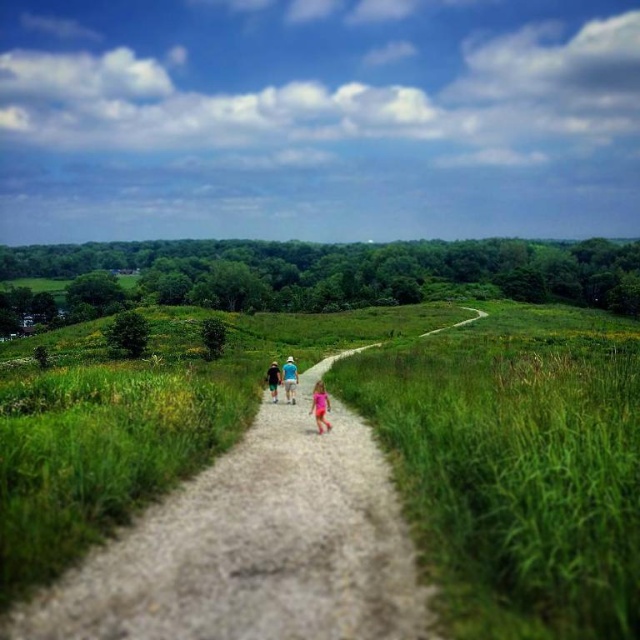
You are standing at the starting point of the dirt path and want to place a blue cotton shirt at center. Where exactly should you place it?

You should place the blue cotton shirt at center at the coordinates point (282,380).

You are a hiker on the dirt path and see two people ahead of you wearing blue shirts. The first person is wearing a blue cotton shirt at center and the second is wearing a blue fabric shirt at center. Which person is closer to you?

The blue cotton shirt at center is in front of the blue fabric shirt at center, so the person wearing the blue cotton shirt at center is closer to you.